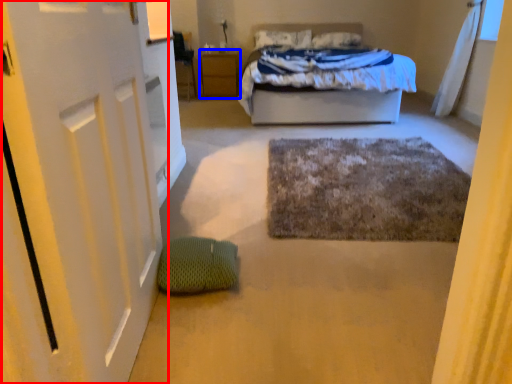
Question: Which object appears closest to the camera in this image, door (highlighted by a red box) or nightstand (highlighted by a blue box)?

Choices:
 (A) door
 (B) nightstand

Answer: (A)